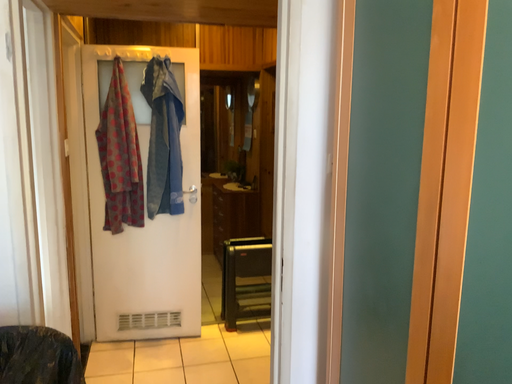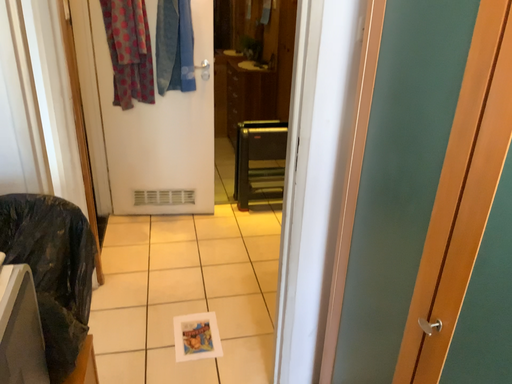
Question: Which way did the camera rotate in the video?

Choices:
 (A) rotated downward
 (B) rotated upward

Answer: (A)